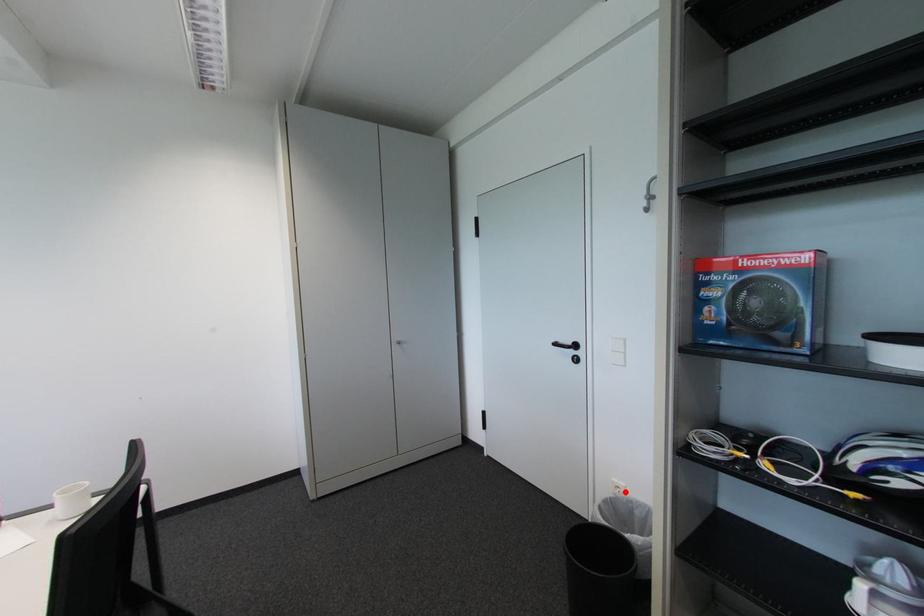
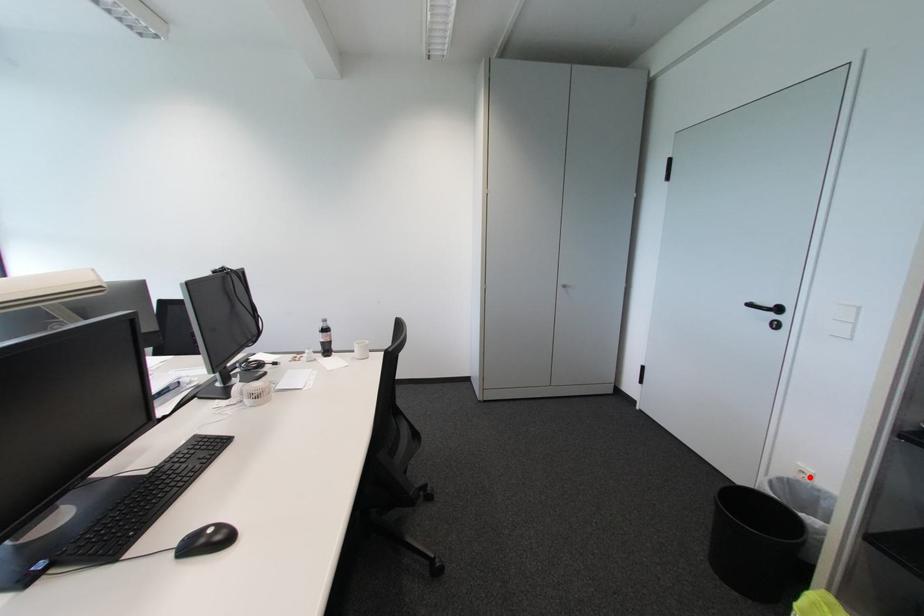
I am providing you with two images of the same scene from different viewpoints. A red point is marked on the first image and another point is marked on the second image. Do the highlighted points in image1 and image2 indicate the same real-world spot?

Yes